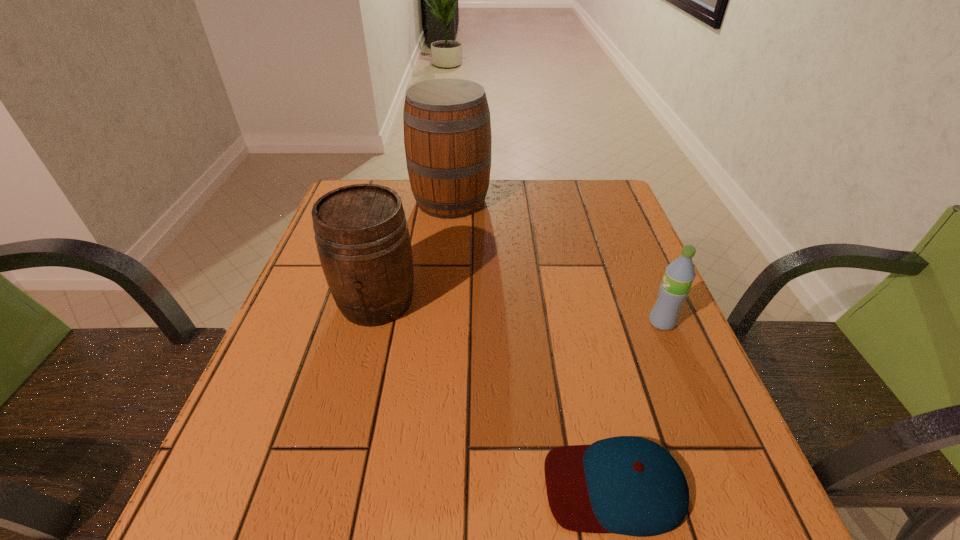
At what (x,y) coordinates should I click in order to perform the action: click on free space between the taller cider and the nearest object. Please return your answer as a coordinate pair (x, y). The image size is (960, 540). Looking at the image, I should click on (533, 343).

Identify the location of free space between the shortest object and the rightmost object. The width and height of the screenshot is (960, 540). (638, 404).

Where is `free point between the farther cider and the rightmost object`? This screenshot has width=960, height=540. free point between the farther cider and the rightmost object is located at coordinates (557, 261).

The image size is (960, 540). I want to click on vacant point located between the farthest object and the shortest object, so click(x=533, y=343).

Locate an element on the screen. free space that is in between the farthest object and the shorter cider is located at coordinates (414, 251).

Find the location of a particular element. The width and height of the screenshot is (960, 540). object that ranks as the closest to the nearest object is located at coordinates (679, 275).

You are a GUI agent. You are given a task and a screenshot of the screen. Output one action in this format:
    pyautogui.click(x=<x>, y=<y>)
    Task: Click on the third closest object to the shortest object
    This screenshot has width=960, height=540.
    Given the screenshot: What is the action you would take?
    coord(447,129)

Identify the location of free location that satisfies the following two spatial constraints: 1. on the side of the second shortest object near the bung hole; 2. on the left side of the second tallest object. The image size is (960, 540). (372, 322).

The image size is (960, 540). Find the location of `free space that satisfies the following two spatial constraints: 1. on the front side of the water bottle; 2. on the right side of the farther cider`. free space that satisfies the following two spatial constraints: 1. on the front side of the water bottle; 2. on the right side of the farther cider is located at coordinates (440, 322).